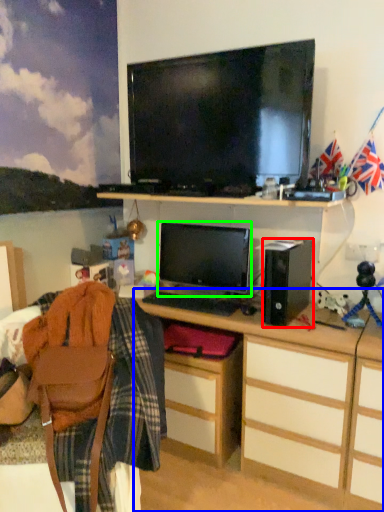
Question: Considering the real-world distances, which object is farthest from speaker (highlighted by a red box)? desk (highlighted by a blue box) or computer monitor (highlighted by a green box)?

Choices:
 (A) desk
 (B) computer monitor

Answer: (A)